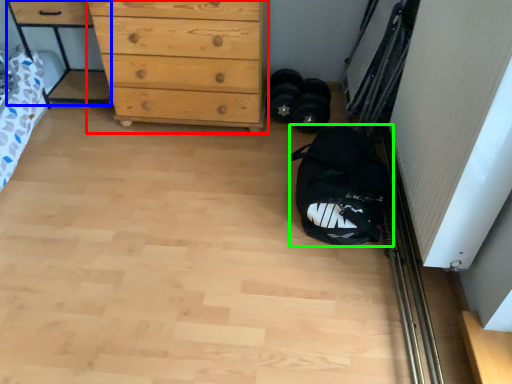
Question: Which object is positioned farthest from chest of drawers (highlighted by a red box)? Select from cabinetry (highlighted by a blue box) and sack (highlighted by a green box).

Choices:
 (A) cabinetry
 (B) sack

Answer: (B)